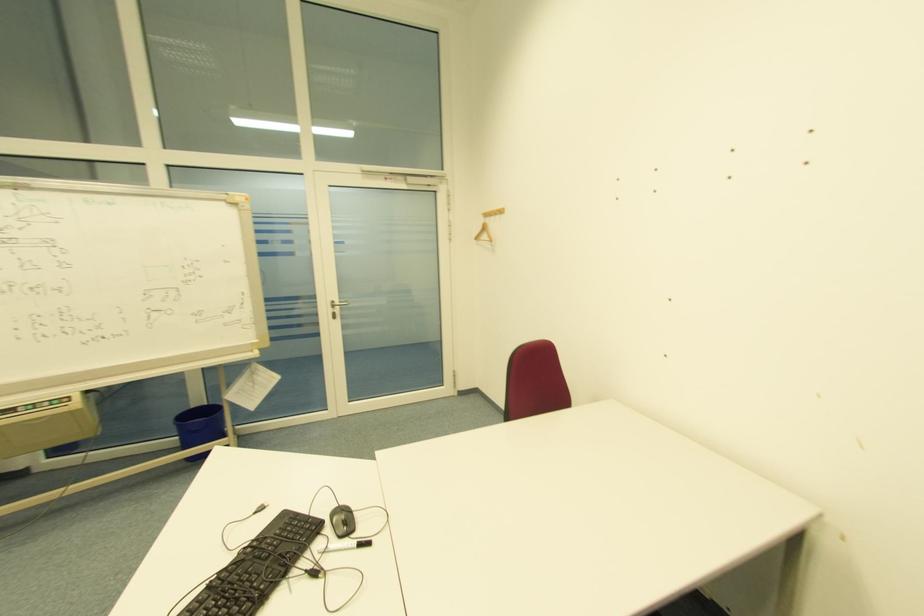
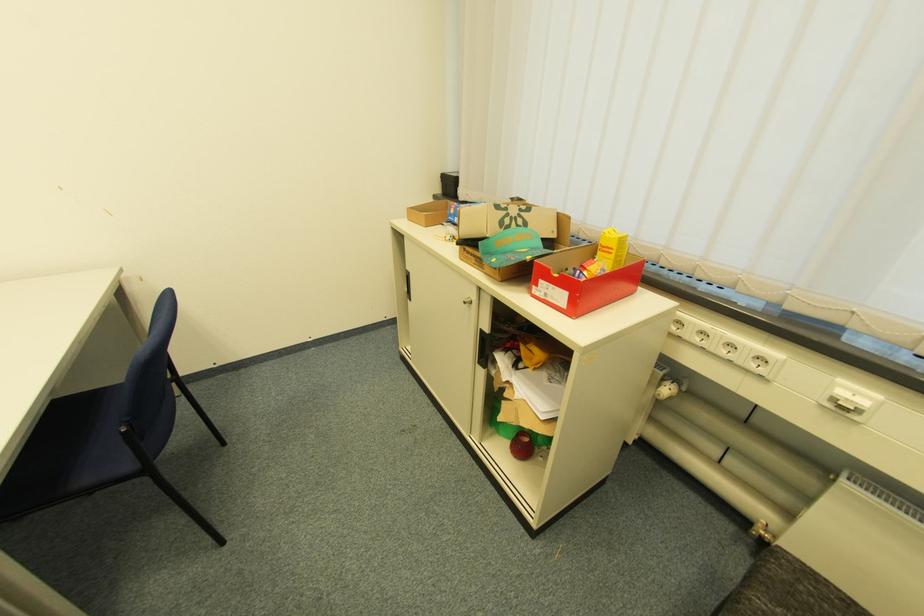
The images are taken continuously from a first-person perspective. In which direction is your viewpoint rotating?

The camera rotated toward right-down.